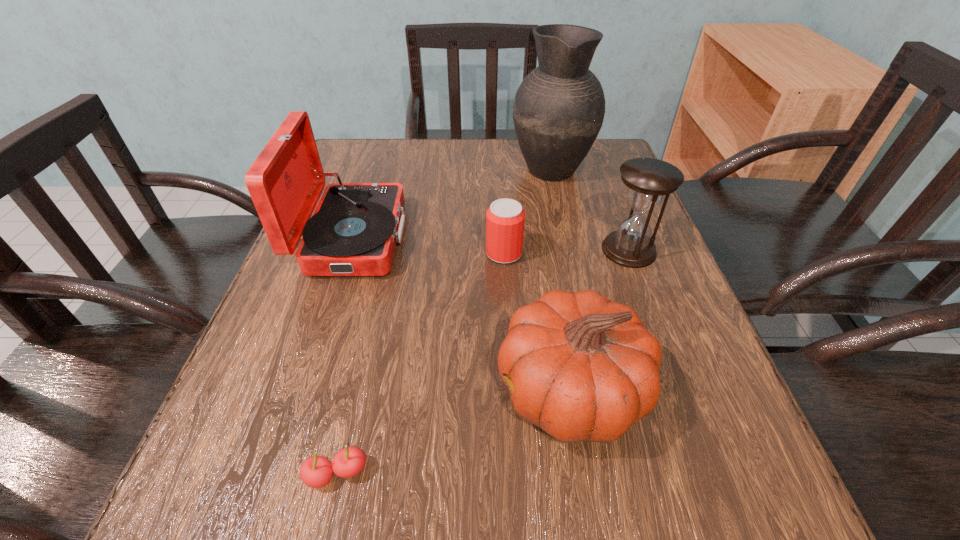
You are a GUI agent. You are given a task and a screenshot of the screen. Output one action in this format:
    pyautogui.click(x=<x>, y=<y>)
    Task: Click on the pumpkin that is positioned at the right edge
    The height and width of the screenshot is (540, 960).
    Given the screenshot: What is the action you would take?
    pyautogui.click(x=582, y=368)

The height and width of the screenshot is (540, 960). I want to click on object positioned at the near left corner, so click(x=317, y=471).

This screenshot has width=960, height=540. What are the coordinates of `object present at the far right corner` in the screenshot? It's located at (558, 111).

Where is `free region at the far edge of the desktop`? free region at the far edge of the desktop is located at coordinates (542, 181).

Identify the location of vacant area at the near edge. (349, 504).

In the image, there is a desktop. In order to click on free space at the left edge in this screenshot , I will do `click(227, 421)`.

Identify the location of free space at the right edge of the desktop. The image size is (960, 540). (624, 195).

Image resolution: width=960 pixels, height=540 pixels. What are the coordinates of `free location at the far left corner of the desktop` in the screenshot? It's located at (357, 173).

The image size is (960, 540). What are the coordinates of `vacant area at the far right corner of the desktop` in the screenshot? It's located at (612, 139).

This screenshot has width=960, height=540. In order to click on vacant area that lies between the pumpkin and the phonograph_record in this screenshot , I will do `click(462, 314)`.